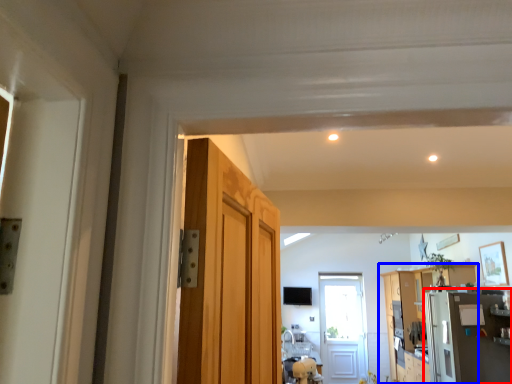
Question: Among these objects, which one is farthest to the camera, appliance (highlighted by a red box) or cabinetry (highlighted by a blue box)?

Choices:
 (A) appliance
 (B) cabinetry

Answer: (B)